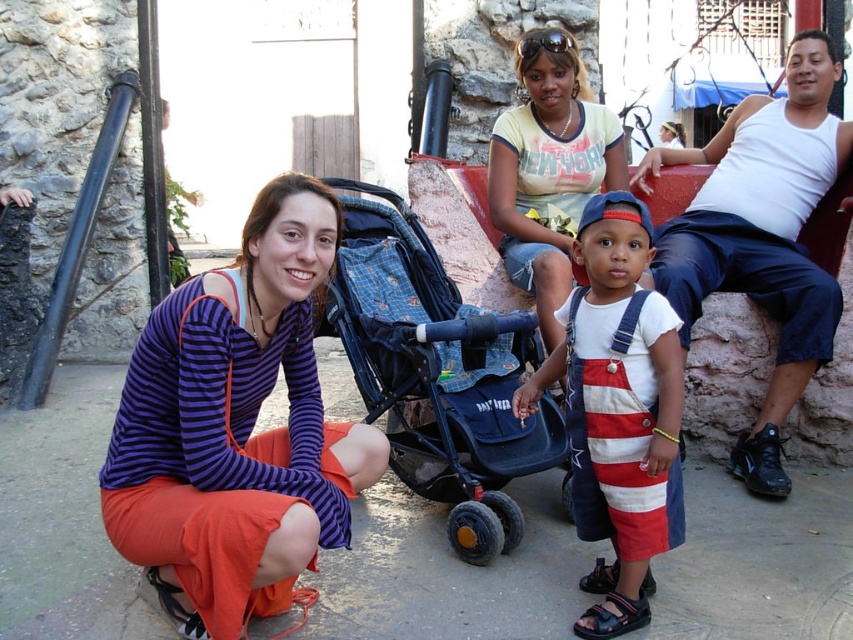
Is purple striped shirt at lower left further to the viewer compared to yellow t-shirt at upper center?

No, it is in front of yellow t-shirt at upper center.

Which is more to the right, purple striped shirt at lower left or yellow t-shirt at upper center?

yellow t-shirt at upper center is more to the right.

Is point (274, 522) more distant than point (575, 54)?

No, (274, 522) is in front of (575, 54).

At what (x,y) coordinates should I click in order to perform the action: click on purple striped shirt at lower left. Please return your answer as a coordinate pair (x, y). The image size is (853, 640). Looking at the image, I should click on (236, 428).

Is blue fabric stroller at center bigger than striped denim overalls at center?

Yes.

Can you confirm if blue fabric stroller at center is wider than striped denim overalls at center?

Correct, the width of blue fabric stroller at center exceeds that of striped denim overalls at center.

Find the location of a particular element. This screenshot has width=853, height=640. blue fabric stroller at center is located at coordinates (438, 372).

Does blue fabric stroller at center come in front of black synthetic sandal at lower center?

That is False.

Which is behind, point (432, 280) or point (625, 618)?

Positioned behind is point (432, 280).

Locate an element on the screen. The height and width of the screenshot is (640, 853). blue fabric stroller at center is located at coordinates (438, 372).

The image size is (853, 640). Find the location of `blue fabric stroller at center`. blue fabric stroller at center is located at coordinates (438, 372).